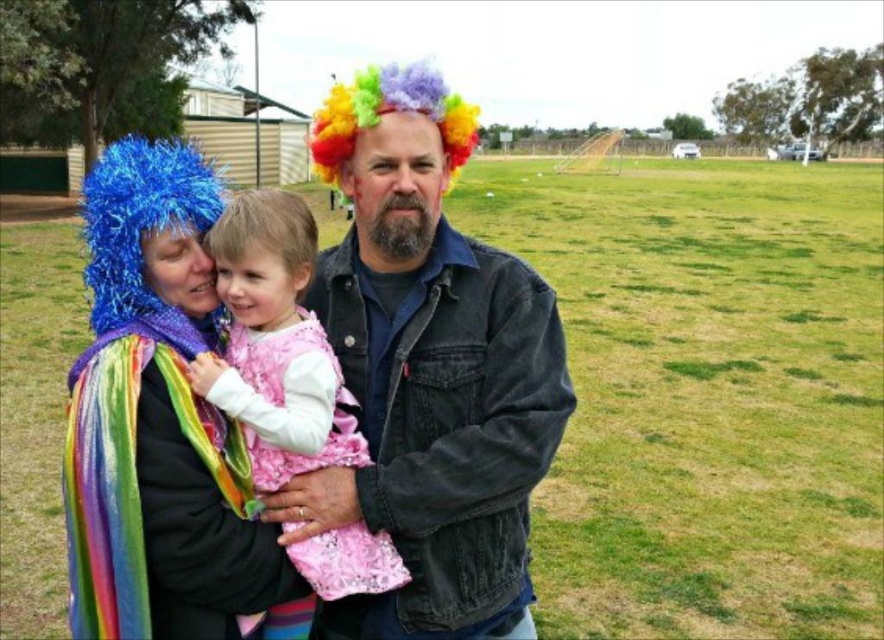
Question: Estimate the real-world distances between objects in this image. Which object is closer to the pink satin dress at center?

Choices:
 (A) rainbow fabric cape at left
 (B) denim jacket at center

Answer: (A)

Question: Does denim jacket at center appear on the left side of pink satin dress at center?

Choices:
 (A) no
 (B) yes

Answer: (A)

Question: Among these points, which one is nearest to the camera?

Choices:
 (A) (357, 564)
 (B) (454, 356)
 (C) (82, 476)

Answer: (C)

Question: Does denim jacket at center appear on the left side of rainbow fabric cape at left?

Choices:
 (A) no
 (B) yes

Answer: (A)

Question: Can you confirm if denim jacket at center is smaller than pink satin dress at center?

Choices:
 (A) no
 (B) yes

Answer: (B)

Question: Which object is the closest to the pink satin dress at center?

Choices:
 (A) rainbow fabric cape at left
 (B) denim jacket at center

Answer: (A)